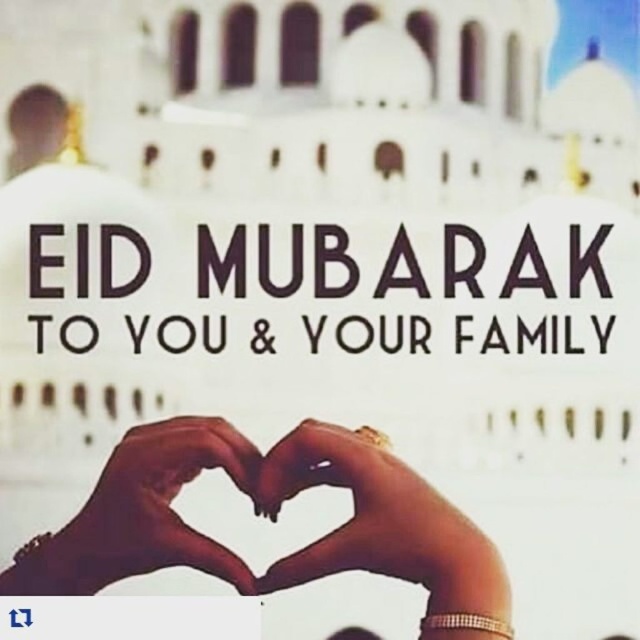
You are designing a digital greeting card and want to place a gold metallic sticker exactly at the center of the card. The card has a coordinate system where the bottom left corner is at point 0,0 and the top right corner is at point 1,1. According to the scene description, is the gold metallic ring at center positioned at the exact center of the card?

The gold metallic ring at center is positioned at point (385, 529), which is not the exact center of the card. The exact center would be at point (320, 320). Therefore, the ring is not placed at the card center.

You are designing a greeting card and want to ensure the gold metallic ring at center and brown skin tone hands at center are close enough to form a cohesive design. Given that the minimum distance for cohesion is 2 meters, can they be placed within that range?

The gold metallic ring at center and brown skin tone hands at center are 4.52 meters apart, which exceeds the minimum distance of 2 meters required for cohesion. Therefore, they cannot be placed within the desired range for a cohesive design.